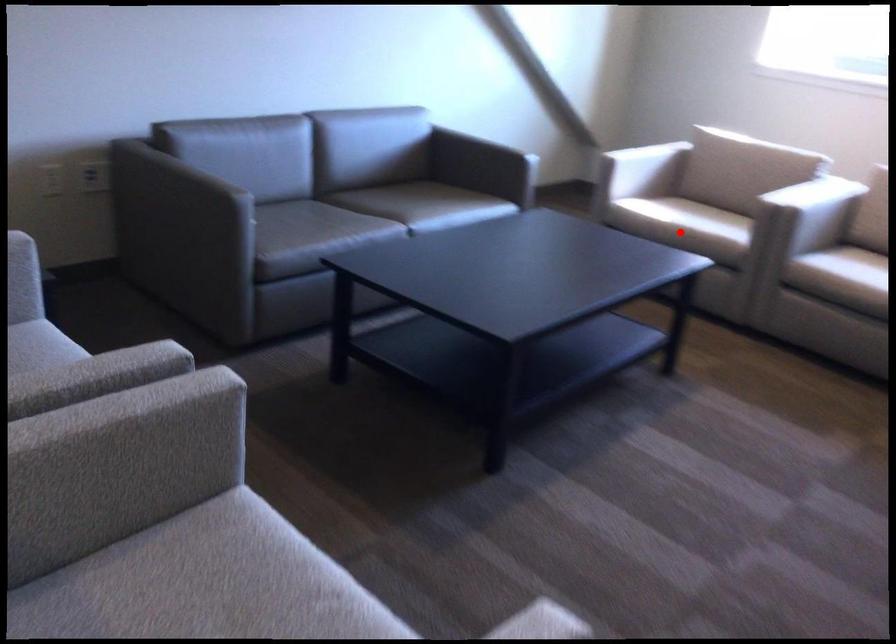
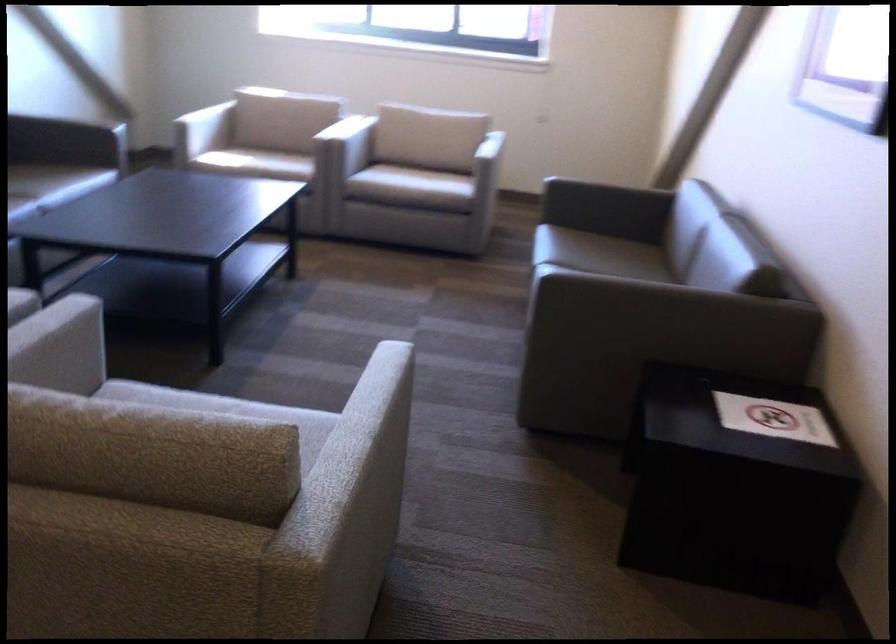
The point at the highlighted location is marked in the first image. Where is the corresponding point in the second image?

(255, 163)